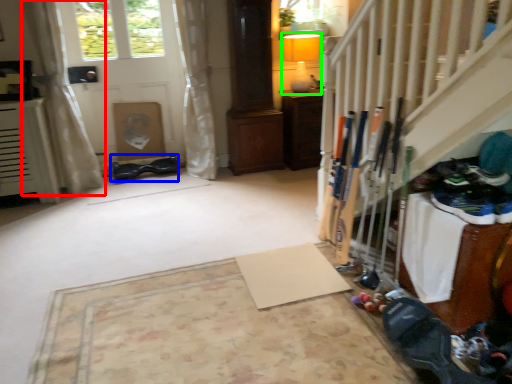
Question: Which object is the farthest from curtain (highlighted by a red box)? Choose among these: shoe (highlighted by a blue box) or lamp (highlighted by a green box).

Choices:
 (A) shoe
 (B) lamp

Answer: (B)